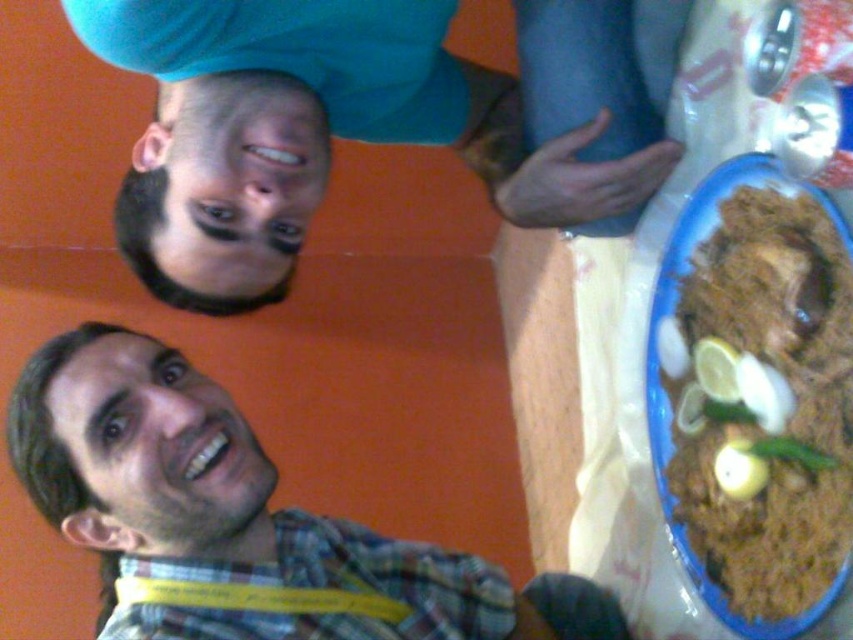
From the picture: You are standing in front of the image and want to reach out to touch the blue fabric shirt at upper center. Given that your arm can extend 60 centimeters, will you be able to reach it?

The blue fabric shirt at upper center is 63.27 centimeters away from the viewer. Since your arm can only extend 60 centimeters, you will not be able to reach it.